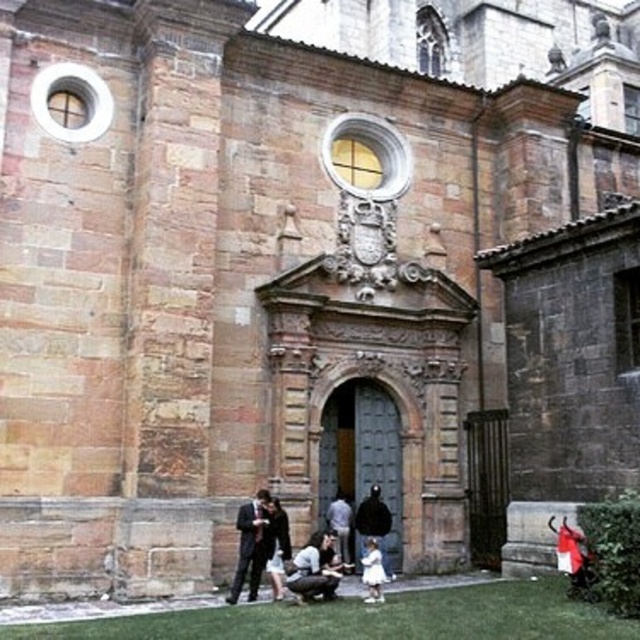
You are standing at the entrance of the historic stone building and want to take a photo. There are two points marked on the facade. The first point is at coordinates point [250,618] and the second is at point [365,580]. Which point will appear larger in your camera view?

Point [250,618] is closer to the camera than point [365,580], so it will appear larger in the camera view.

Looking at this image, you are a photographer standing at the entrance of the historic stone building. You need to position two subjects for a photo shoot. The subjects are wearing a dark suit at center and a matte black jacket at lower center. According to the scene, which subject should you instruct to move to the right to align with the central arched doorway?

The dark suit at center should move to the right to align with the central arched doorway because it is currently positioned to the left of the matte black jacket at lower center, which is already at the lower center near the entrance.